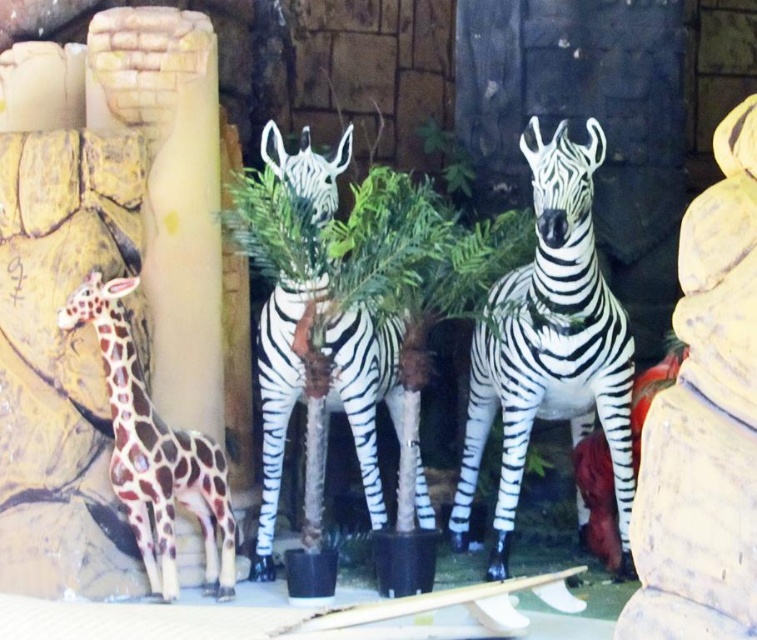
Question: Which of the following is the closest to the observer?

Choices:
 (A) (581, 196)
 (B) (106, 346)

Answer: (B)

Question: Can you confirm if white glossy zebra at center is smaller than shiny brown giraffe at left?

Choices:
 (A) no
 (B) yes

Answer: (A)

Question: Among these objects, which one is nearest to the camera?

Choices:
 (A) white glossy zebra at center
 (B) shiny brown giraffe at left

Answer: (A)

Question: Is white glossy zebra at center to the right of shiny brown giraffe at left from the viewer's perspective?

Choices:
 (A) yes
 (B) no

Answer: (A)

Question: Is white glossy zebra at center behind shiny brown giraffe at left?

Choices:
 (A) no
 (B) yes

Answer: (A)

Question: Which point is farther to the camera?

Choices:
 (A) white glossy zebra at center
 (B) shiny brown giraffe at left

Answer: (B)